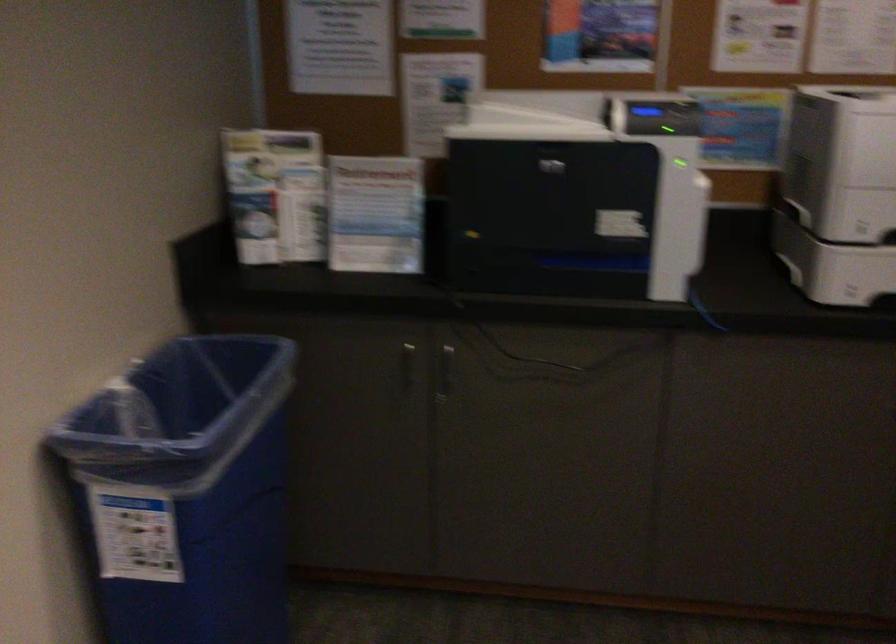
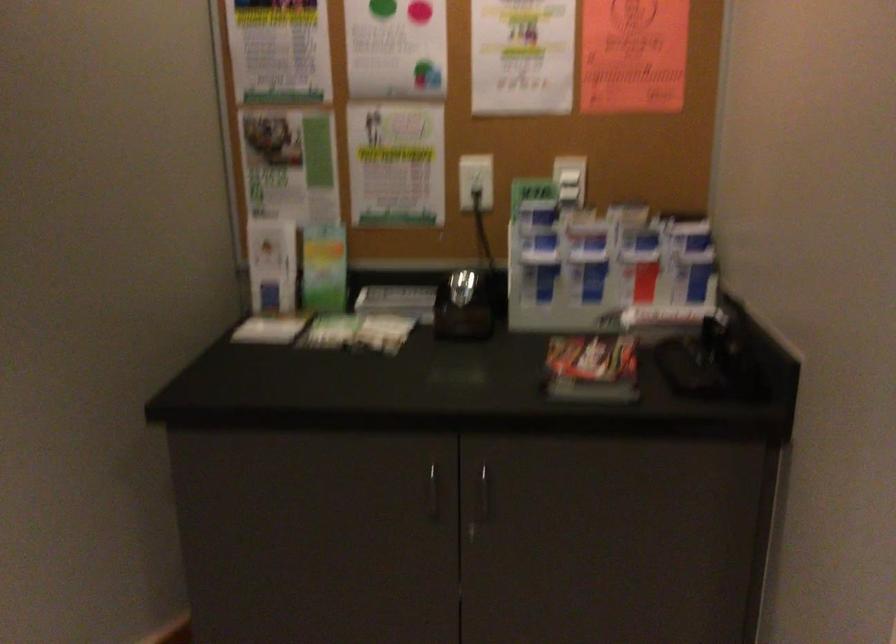
Question: The images are taken continuously from a first-person perspective. In which direction is your viewpoint rotating?

Choices:
 (A) Left
 (B) Right
 (C) Up
 (D) Down

Answer: (A)